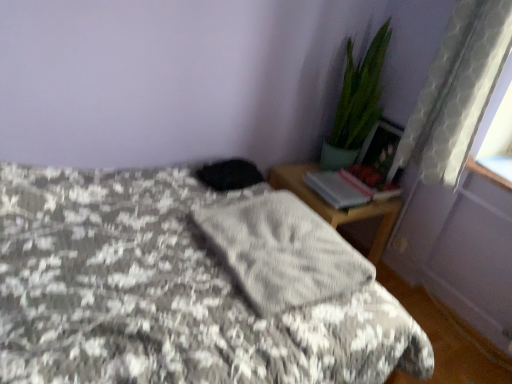
This screenshot has width=512, height=384. Find the location of `vacant space underneath hardcover book at right (from a real-world perspective)`. vacant space underneath hardcover book at right (from a real-world perspective) is located at coordinates (334, 194).